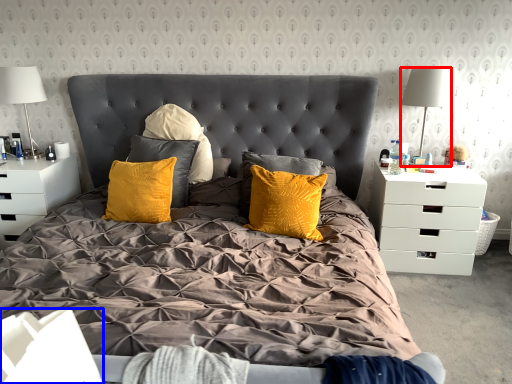
Question: Which of the following is the farthest to the observer, lamp (highlighted by a red box) or box (highlighted by a blue box)?

Choices:
 (A) lamp
 (B) box

Answer: (A)